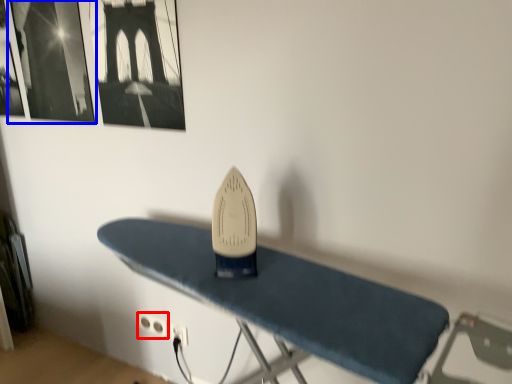
Question: Which of the following is the closest to the observer, plug (highlighted by a red box) or picture frame (highlighted by a blue box)?

Choices:
 (A) plug
 (B) picture frame

Answer: (B)